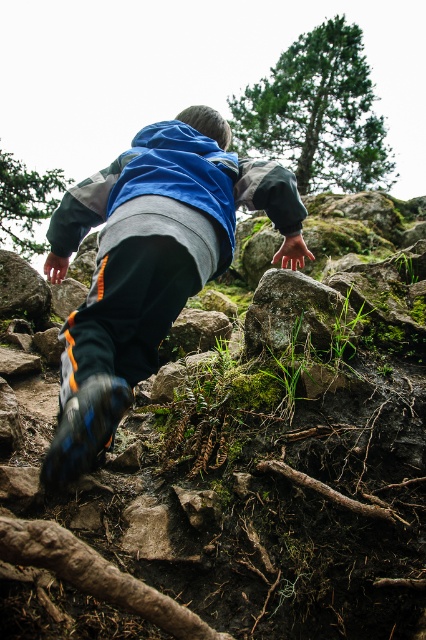
Question: Observing the image, what is the correct spatial positioning of matte blue jacket at center in reference to rough textured rock at center?

Choices:
 (A) left
 (B) right

Answer: (A)

Question: Is matte blue jacket at center positioned at the back of blue fleece jacket at center?

Choices:
 (A) no
 (B) yes

Answer: (A)

Question: Considering the real-world distances, which object is closest to the mossy rock at center?

Choices:
 (A) blue fleece jacket at center
 (B) matte blue jacket at center

Answer: (B)

Question: Which is nearer to the rough textured rock at center?

Choices:
 (A) matte blue jacket at center
 (B) mossy rock at center

Answer: (B)

Question: Which point appears closest to the camera in this image?

Choices:
 (A) (284, 234)
 (B) (235, 195)
 (C) (281, 352)
 (D) (37, 476)

Answer: (B)

Question: Is mossy rock at center smaller than rough textured rock at center?

Choices:
 (A) yes
 (B) no

Answer: (B)